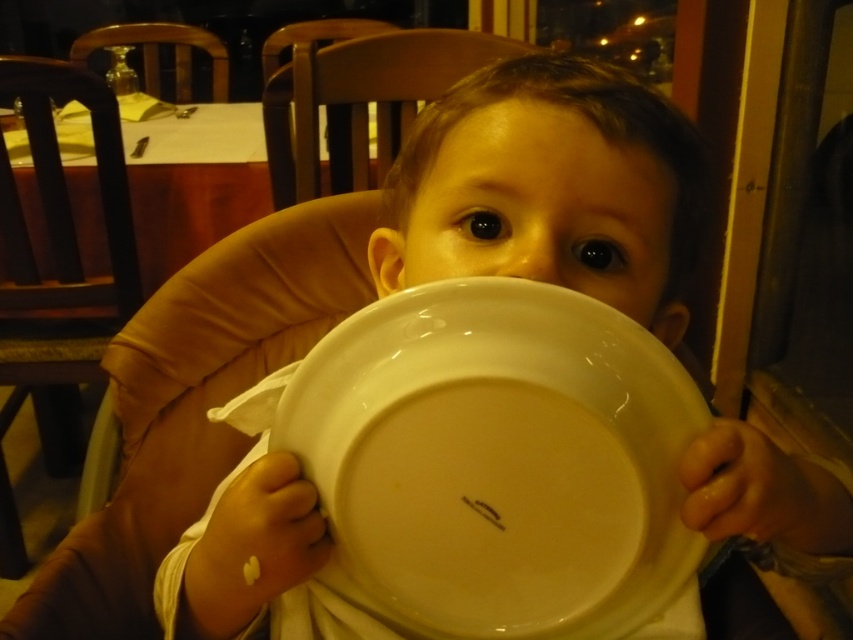
Which is more to the left, smooth skin face at center or wooden chair at upper left?

Positioned to the left is wooden chair at upper left.

Is point (662, 310) closer to camera compared to point (129, 35)?

That is True.

The width and height of the screenshot is (853, 640). In order to click on smooth skin face at center in this screenshot , I will do `click(543, 211)`.

Who is lower down, wooden chair at left or wooden chair at upper center?

wooden chair at left

Is wooden chair at left positioned before wooden chair at upper center?

Yes, it is.

Locate an element on the screen. This screenshot has width=853, height=640. wooden chair at left is located at coordinates (64, 202).

Where is `wooden chair at left`? The image size is (853, 640). wooden chair at left is located at coordinates (64, 202).

Does wooden chair at left have a greater width compared to wooden chair at upper left?

No, wooden chair at left is not wider than wooden chair at upper left.

Is wooden chair at left below wooden chair at upper left?

Correct, wooden chair at left is located below wooden chair at upper left.

This screenshot has width=853, height=640. Find the location of `wooden chair at left`. wooden chair at left is located at coordinates (64, 202).